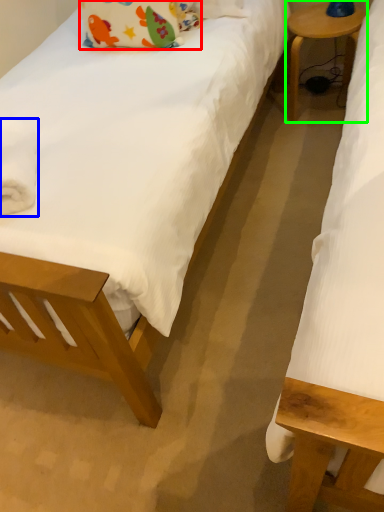
Question: Estimate the real-world distances between objects in this image. Which object is closer to pillow (highlighted by a red box), material (highlighted by a blue box) or table (highlighted by a green box)?

Choices:
 (A) material
 (B) table

Answer: (B)